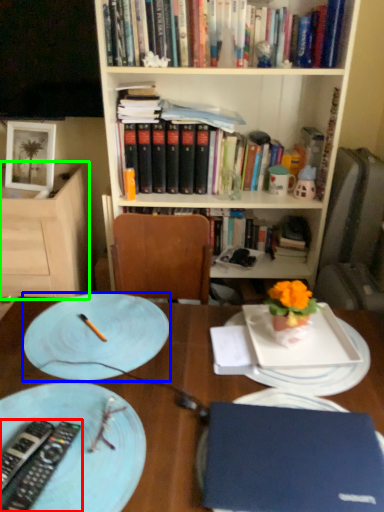
Question: Which object is positioned closest to remote control (highlighted by a red box)? Select from plate (highlighted by a blue box) and shelf (highlighted by a green box).

Choices:
 (A) plate
 (B) shelf

Answer: (A)